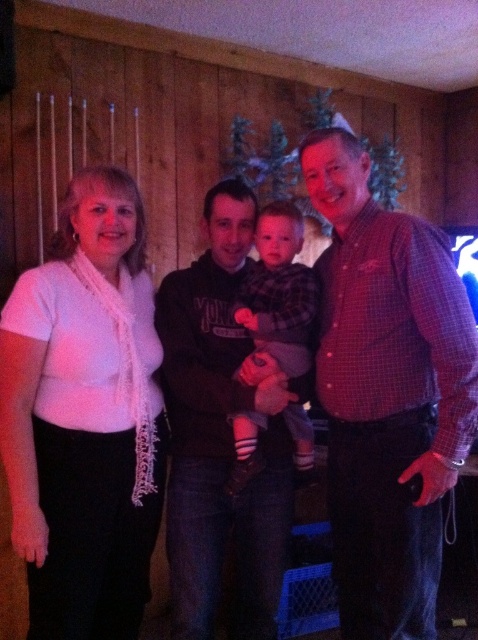
How much distance is there between plaid shirt at right and flannel shirt at center?

A distance of 9.62 inches exists between plaid shirt at right and flannel shirt at center.

Is plaid shirt at right to the left of flannel shirt at center from the viewer's perspective?

No, plaid shirt at right is not to the left of flannel shirt at center.

Does point (348, 616) come in front of point (243, 426)?

No, it is not.

This screenshot has width=478, height=640. Find the location of `plaid shirt at right`. plaid shirt at right is located at coordinates (387, 392).

Can you confirm if plaid shirt at right is smaller than dark brown hoodie at center?

Actually, plaid shirt at right might be larger than dark brown hoodie at center.

Does point (423, 326) lie in front of point (267, 595)?

Yes, it is.

Where is `plaid shirt at right`? plaid shirt at right is located at coordinates (387, 392).

Where is `plaid shirt at right`? Image resolution: width=478 pixels, height=640 pixels. plaid shirt at right is located at coordinates (387, 392).

Is white lace scarf at left positioned before dark brown hoodie at center?

Yes, it is.

I want to click on white lace scarf at left, so click(85, 417).

What do you see at coordinates (85, 417) in the screenshot?
I see `white lace scarf at left` at bounding box center [85, 417].

At what (x,y) coordinates should I click in order to perform the action: click on white lace scarf at left. Please return your answer as a coordinate pair (x, y). The width and height of the screenshot is (478, 640). Looking at the image, I should click on (85, 417).